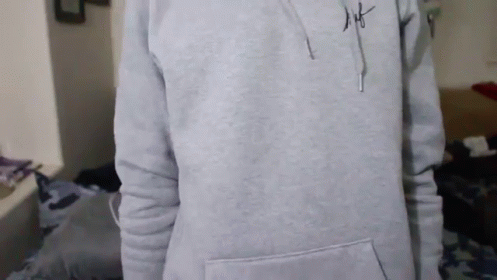
Find the location of a particular element. This screenshot has width=497, height=280. cammo bed pillows is located at coordinates (221, 111), (306, 120).